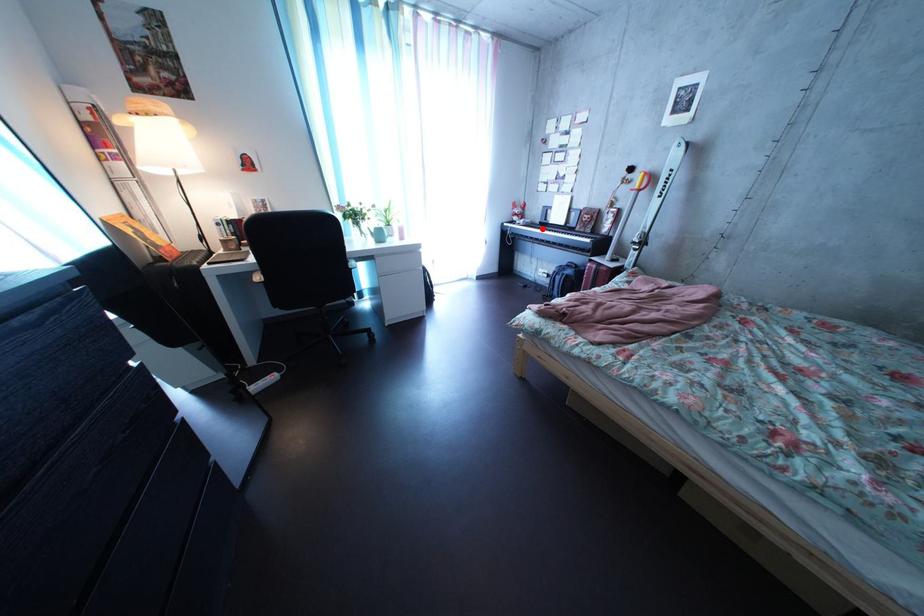
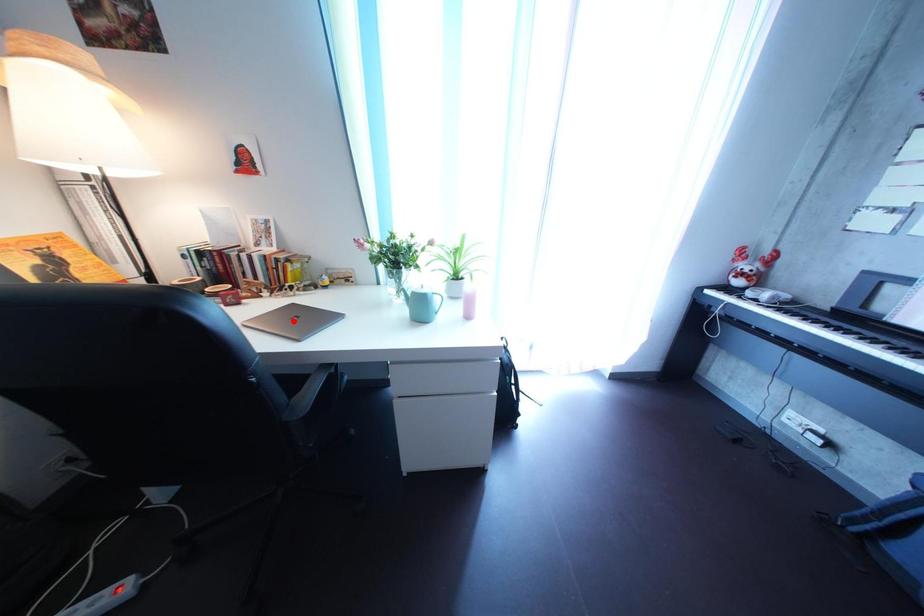
I am providing you with two images of the same scene from different viewpoints. A red point is marked on the first image and another point is marked on the second image. Does the point marked in image1 correspond to the same location as the one in image2?

No